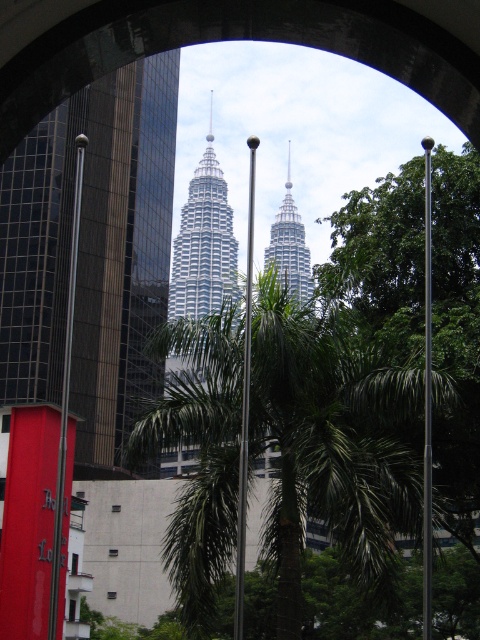
Question: Which point is closer to the camera?

Choices:
 (A) (194, 268)
 (B) (249, 264)
 (C) (3, 324)
 (D) (228, 388)

Answer: (B)

Question: Among these points, which one is nearest to the camera?

Choices:
 (A) (424, 516)
 (B) (243, 445)
 (C) (285, 376)

Answer: (A)

Question: Does green leafy palm tree at center appear over silver glass tower at center?

Choices:
 (A) no
 (B) yes

Answer: (A)

Question: Is silver glass tower at center bigger than polished metal pole at center?

Choices:
 (A) yes
 (B) no

Answer: (A)

Question: Which point is farther to the camera?

Choices:
 (A) (76, 204)
 (B) (427, 573)
 (C) (233, 266)

Answer: (C)

Question: Observing the image, what is the correct spatial positioning of polished metal pole at center in reference to metallic pole at center?

Choices:
 (A) above
 (B) below

Answer: (B)